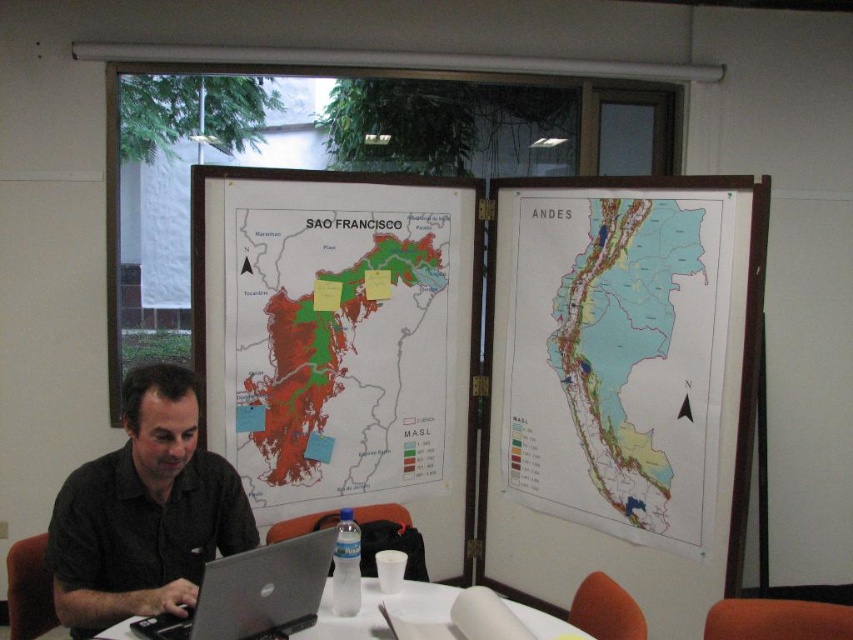
Question: Is light blue paper map at center right in front of black matte shirt at center?

Choices:
 (A) no
 (B) yes

Answer: (A)

Question: Among these objects, which one is nearest to the camera?

Choices:
 (A) green matte map at center
 (B) light blue paper map at center right
 (C) white paper at center
 (D) black matte shirt at center

Answer: (C)

Question: Does black matte shirt at center appear on the left side of white paper at center?

Choices:
 (A) yes
 (B) no

Answer: (A)

Question: Estimate the real-world distances between objects in this image. Which object is closer to the white paper at center?

Choices:
 (A) green matte map at center
 (B) light blue paper map at center right

Answer: (A)

Question: Which of the following is the closest to the observer?

Choices:
 (A) light blue paper map at center right
 (B) silver metallic laptop at lower left

Answer: (B)

Question: Can you confirm if silver metallic laptop at lower left is smaller than white paper at center?

Choices:
 (A) no
 (B) yes

Answer: (B)